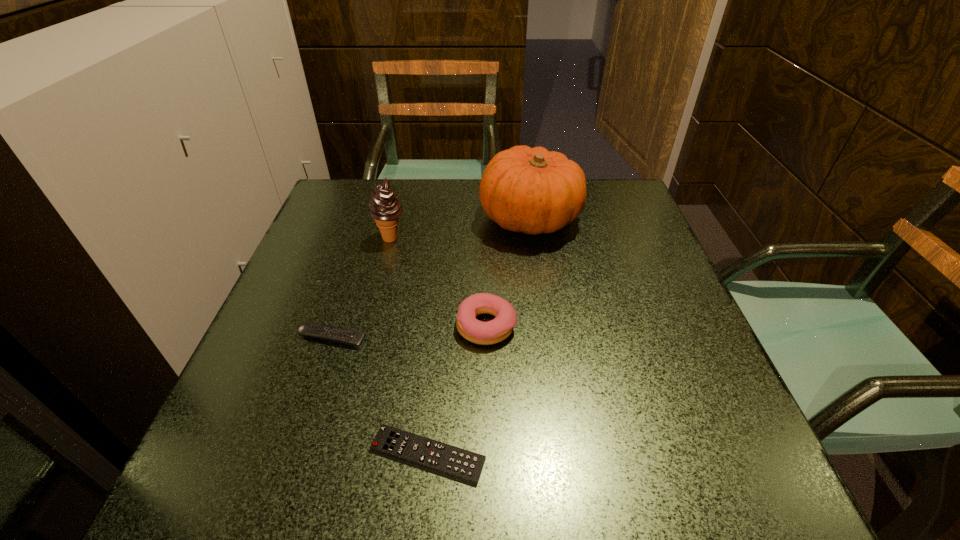
In the image, there is a desktop. At what (x,y) coordinates should I click in order to perform the action: click on free space at the far edge. Please return your answer as a coordinate pair (x, y). Looking at the image, I should click on (420, 197).

Identify the location of blank area at the near edge. This screenshot has width=960, height=540. (519, 466).

Where is `free space at the left edge`? free space at the left edge is located at coordinates (349, 286).

This screenshot has width=960, height=540. In order to click on vacant region at the right edge of the desktop in this screenshot , I will do `click(646, 282)`.

Identify the location of free region at the near left corner of the desktop. This screenshot has width=960, height=540. (255, 489).

Where is `vacant region at the far right corner of the desktop`? Image resolution: width=960 pixels, height=540 pixels. vacant region at the far right corner of the desktop is located at coordinates (614, 222).

The image size is (960, 540). What are the coordinates of `vacant space that's between the doughnut and the taller remote control` in the screenshot? It's located at (409, 332).

The height and width of the screenshot is (540, 960). What are the coordinates of `free space that is in between the nearer remote control and the third shortest object` in the screenshot? It's located at (457, 390).

Locate an element on the screen. Image resolution: width=960 pixels, height=540 pixels. free space between the third shortest object and the right remote control is located at coordinates (457, 390).

The height and width of the screenshot is (540, 960). What are the coordinates of `empty space between the doughnut and the icecream` in the screenshot? It's located at (439, 282).